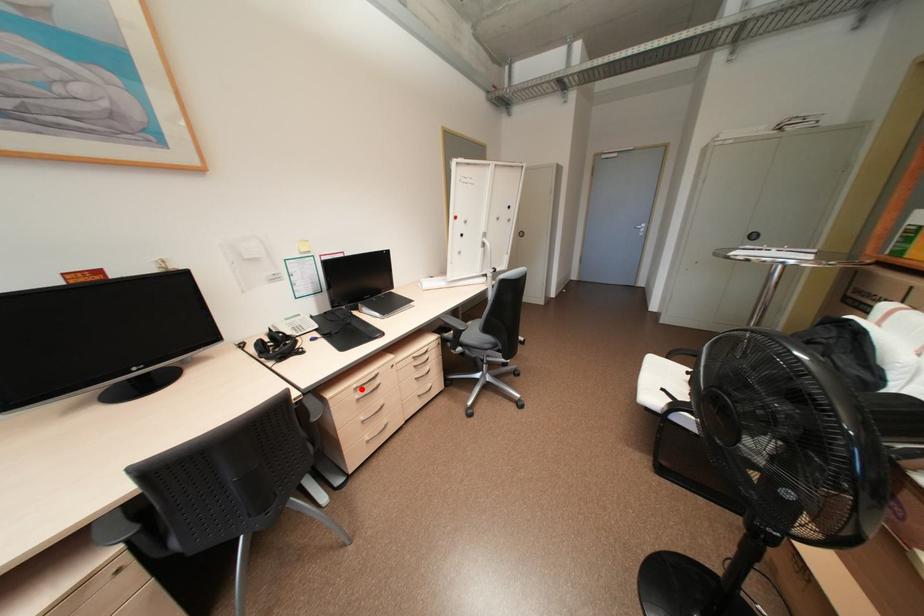
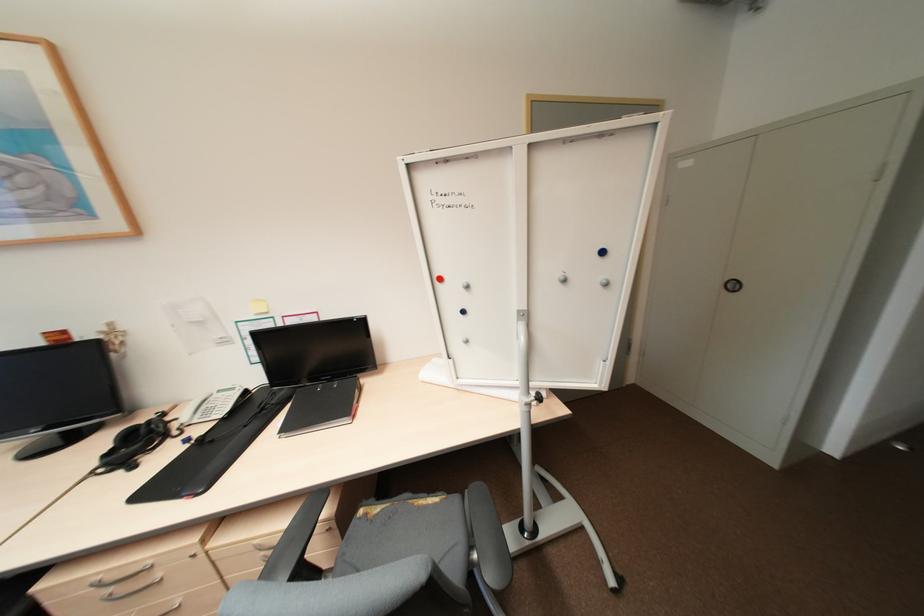
The point at the highlighted location is marked in the first image. Where is the corresponding point in the second image?

(104, 584)